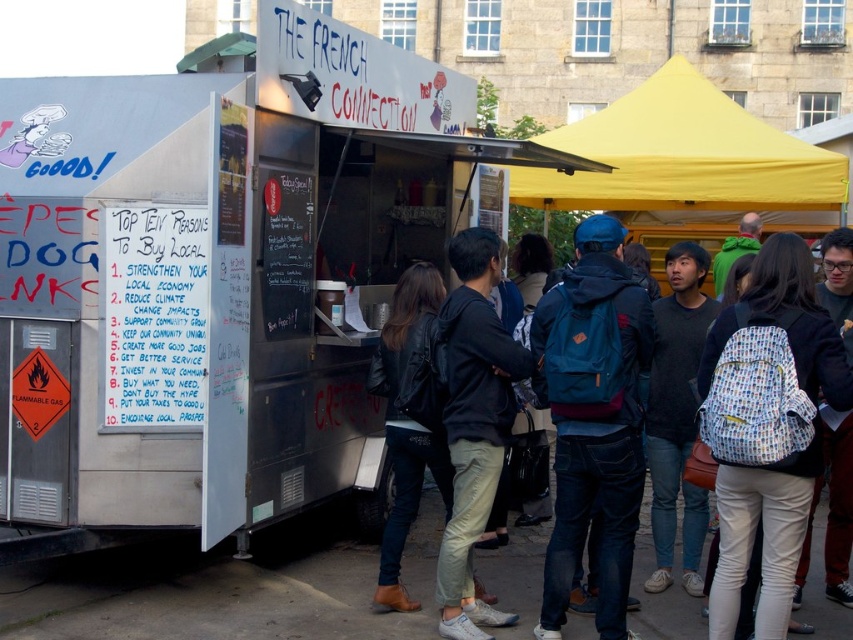
What do you see at coordinates (592, 424) in the screenshot? I see `blue backpack at center` at bounding box center [592, 424].

Who is shorter, blue backpack at center or yellow fabric canopy at upper right?

Standing shorter between the two is yellow fabric canopy at upper right.

Between point (836, 330) and point (750, 136), which one is positioned behind?

The point (750, 136) is behind.

Image resolution: width=853 pixels, height=640 pixels. Identify the location of blue backpack at center. (592, 424).

Who is higher up, metallic silver food truck at center or light beige pants at center?

metallic silver food truck at center is above.

Is metallic silver food truck at center to the left of light beige pants at center from the viewer's perspective?

Correct, you'll find metallic silver food truck at center to the left of light beige pants at center.

Identify the location of metallic silver food truck at center. This screenshot has height=640, width=853. (218, 275).

Which is above, metallic silver food truck at center or blue backpack at center?

metallic silver food truck at center

Does metallic silver food truck at center lie in front of blue backpack at center?

No, metallic silver food truck at center is further to the viewer.

Who is more distant from viewer, (57, 326) or (764, 621)?

The point (57, 326) is behind.

This screenshot has height=640, width=853. I want to click on metallic silver food truck at center, so click(218, 275).